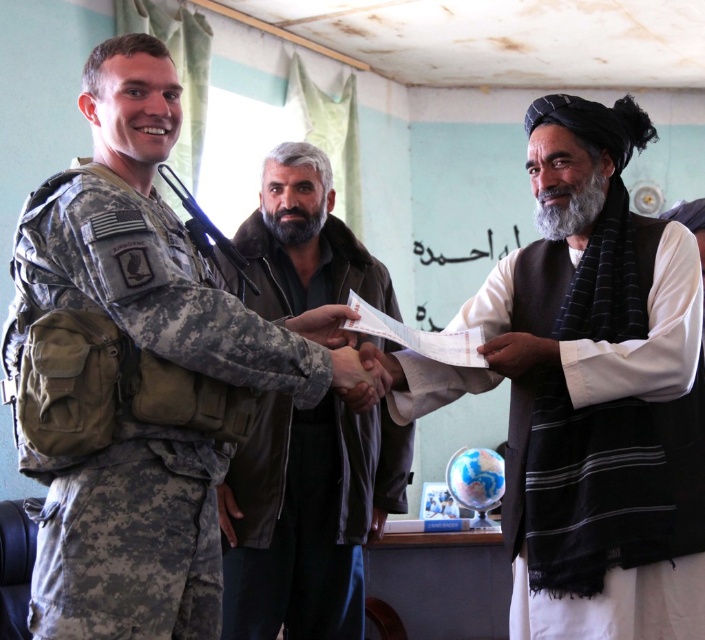
You are organizing a small event in the room and need to place both the dark brown leather jacket at center and the white paper at center on a shelf that can only hold items up to the width of the white paper. Can both items fit on the shelf?

The dark brown leather jacket at center is wider than the white paper at center. Since the shelf can only hold items up to the width of the white paper, the dark brown leather jacket at center cannot fit. Only the white paper at center can be placed on the shelf.